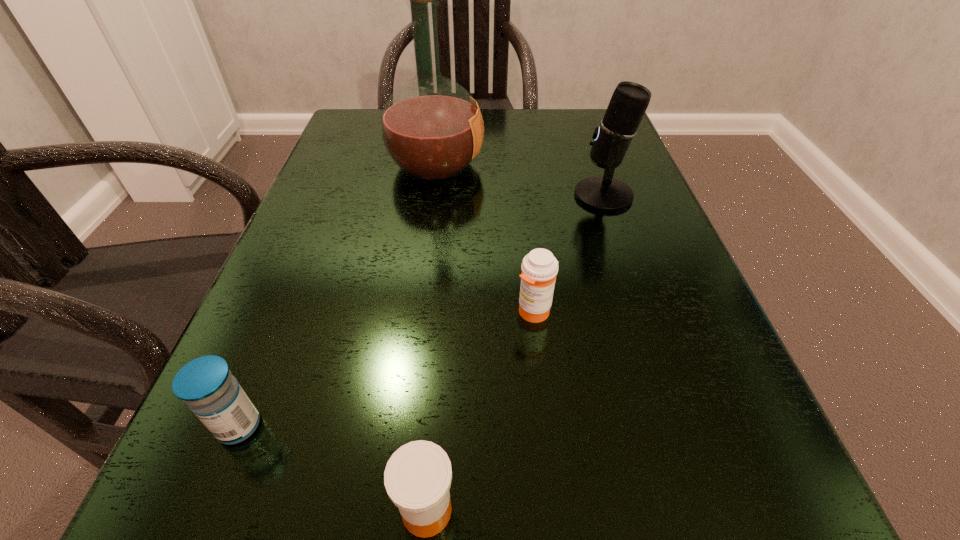
Locate an element on the screen. vacant space at the near right corner is located at coordinates (649, 496).

Where is `empty space between the microphone and the third nearest object`? empty space between the microphone and the third nearest object is located at coordinates [x=568, y=254].

Find the location of a particular element. The height and width of the screenshot is (540, 960). vacant space in between the rightmost object and the rightmost medicine is located at coordinates (568, 254).

Image resolution: width=960 pixels, height=540 pixels. What are the coordinates of `vacant region between the second tallest object and the second nearest object` in the screenshot? It's located at 421,310.

You are a GUI agent. You are given a task and a screenshot of the screen. Output one action in this format:
    pyautogui.click(x=<x>, y=<y>)
    Task: Click on the vacant point located between the liquor and the rightmost medicine
    
    Given the screenshot: What is the action you would take?
    pyautogui.click(x=485, y=238)

Locate an element on the screen. free spot between the third farthest object and the tallest object is located at coordinates (485, 238).

Where is `free spot between the second farthest medicine and the tallest object`? The image size is (960, 540). free spot between the second farthest medicine and the tallest object is located at coordinates (337, 295).

I want to click on free spot between the second object from right to left and the leftmost medicine, so coord(386,369).

Locate which object is the fourth closest to the rightmost medicine. Please provide its 2D coordinates. Your answer should be formatted as a tuple, i.e. [(x, y)], where the tuple contains the x and y coordinates of a point satisfying the conditions above.

[(206, 384)]

This screenshot has height=540, width=960. Find the location of `object that stands as the third closest to the liquor`. object that stands as the third closest to the liquor is located at coordinates [206, 384].